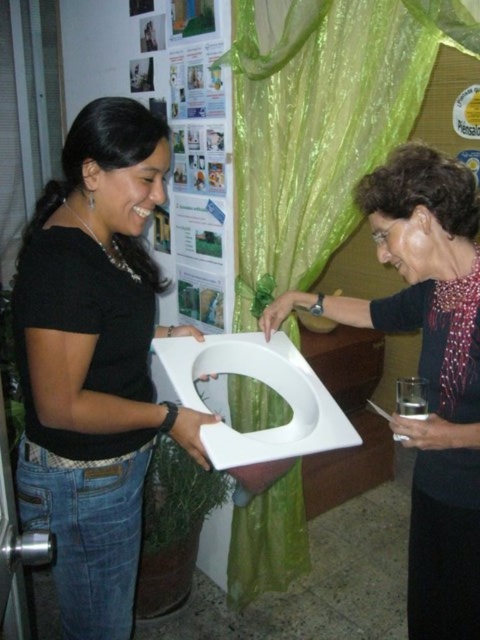
You are a contractor measuring the space between two walls. You need to install a black matte toilet at center that is narrower than the green sheer curtain at center. Can you confirm if the existing space between the walls is sufficient for both items?

The black matte toilet at center is narrower than the green sheer curtain at center, so the space between the walls should be sufficient to accommodate both items as long as their combined width does not exceed the available space.

You are a delivery person who needs to place a small package between the black matte toilet at center and the green sheer curtain at center. Can you fit the package in between them?

The black matte toilet at center is in front of the green sheer curtain at center, so there is no space between them for the package to fit.